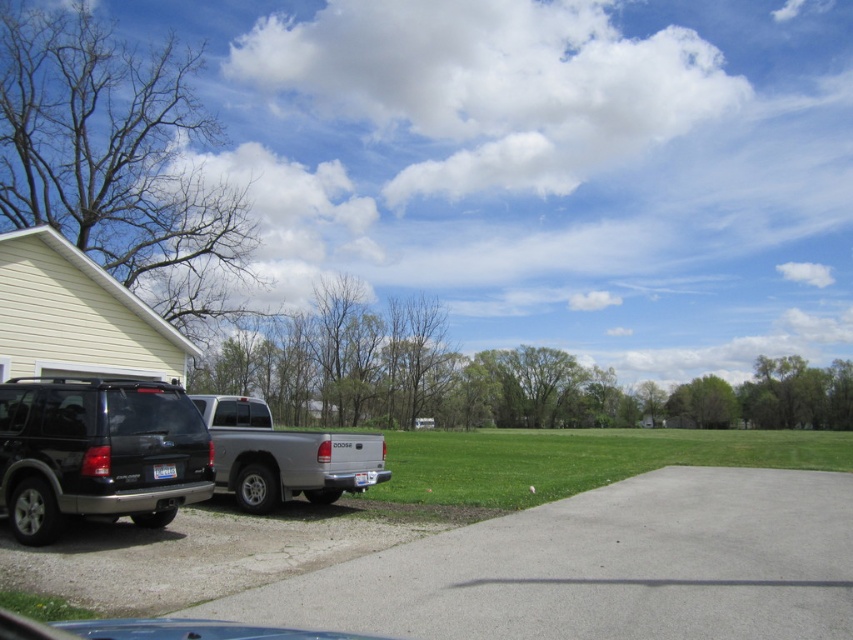
Does shiny black suv at lower left have a greater width compared to silver metallic truck at center?

In fact, shiny black suv at lower left might be narrower than silver metallic truck at center.

Is shiny black suv at lower left bigger than silver metallic truck at center?

Incorrect, shiny black suv at lower left is not larger than silver metallic truck at center.

Which is behind, point (6, 438) or point (263, 440)?

The point (263, 440) is more distant.

At what (x,y) coordinates should I click in order to perform the action: click on shiny black suv at lower left. Please return your answer as a coordinate pair (x, y). Image resolution: width=853 pixels, height=640 pixels. Looking at the image, I should click on (97, 452).

Is gray concrete driveway at lower left bigger than shiny black suv at lower left?

Indeed, gray concrete driveway at lower left has a larger size compared to shiny black suv at lower left.

Who is more distant from viewer, (561, 593) or (125, 397)?

Positioned behind is point (125, 397).

At what (x,y) coordinates should I click in order to perform the action: click on gray concrete driveway at lower left. Please return your answer as a coordinate pair (x, y). This screenshot has width=853, height=640. Looking at the image, I should click on (602, 566).

Which of these two, gray concrete driveway at lower left or silver metallic truck at center, stands taller?

silver metallic truck at center

Measure the distance between gray concrete driveway at lower left and silver metallic truck at center.

The distance of gray concrete driveway at lower left from silver metallic truck at center is 4.67 meters.

The width and height of the screenshot is (853, 640). What do you see at coordinates (602, 566) in the screenshot?
I see `gray concrete driveway at lower left` at bounding box center [602, 566].

This screenshot has width=853, height=640. In order to click on gray concrete driveway at lower left in this screenshot , I will do (x=602, y=566).